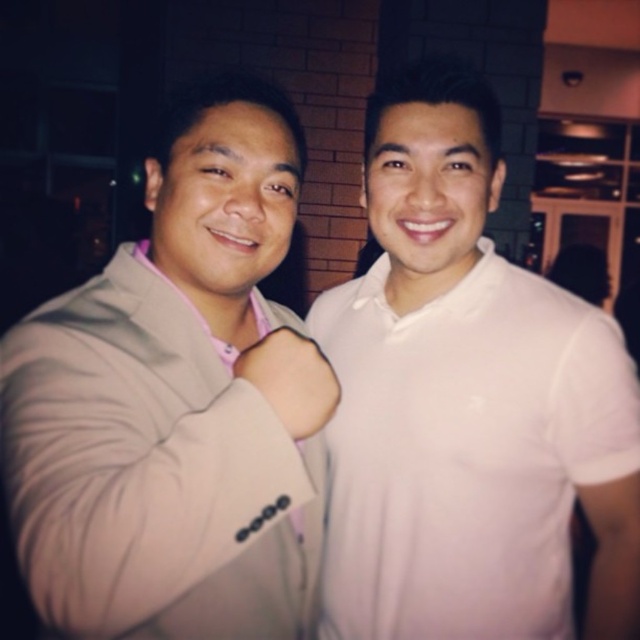
Question: In this image, where is beige fabric suit at left located relative to white cotton polo shirt at right?

Choices:
 (A) left
 (B) right

Answer: (A)

Question: Among these objects, which one is nearest to the camera?

Choices:
 (A) white cotton polo shirt at right
 (B) beige fabric suit at left

Answer: (B)

Question: Which object is closer to the camera taking this photo?

Choices:
 (A) white cotton polo shirt at right
 (B) beige fabric suit at left

Answer: (B)

Question: Is beige fabric suit at left bigger than white cotton polo shirt at right?

Choices:
 (A) no
 (B) yes

Answer: (B)

Question: Where is beige fabric suit at left located in relation to white cotton polo shirt at right in the image?

Choices:
 (A) above
 (B) below

Answer: (A)